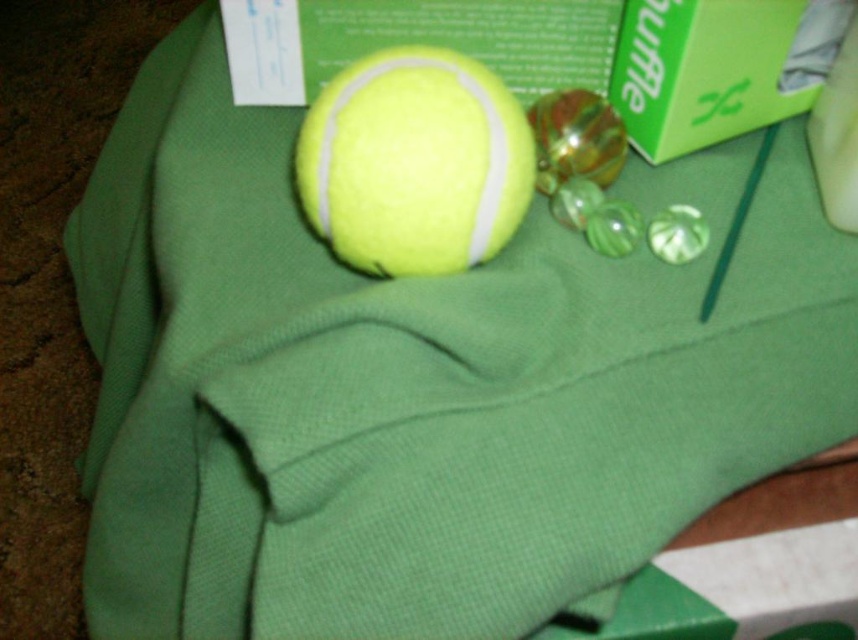
Question: Is yellow matte tennis ball at center to the left of green cardboard box at upper right from the viewer's perspective?

Choices:
 (A) yes
 (B) no

Answer: (A)

Question: Which point is farther to the camera?

Choices:
 (A) yellow matte tennis ball at center
 (B) green cardboard box at upper right

Answer: (B)

Question: Which point is farther from the camera taking this photo?

Choices:
 (A) (710, 61)
 (B) (436, 205)

Answer: (A)

Question: Can you confirm if yellow matte tennis ball at center is bigger than green cardboard box at upper right?

Choices:
 (A) no
 (B) yes

Answer: (B)

Question: Which of the following is the closest to the observer?

Choices:
 (A) yellow matte tennis ball at center
 (B) green cardboard box at upper right

Answer: (A)

Question: Can you confirm if yellow matte tennis ball at center is positioned below green cardboard box at upper right?

Choices:
 (A) yes
 (B) no

Answer: (A)